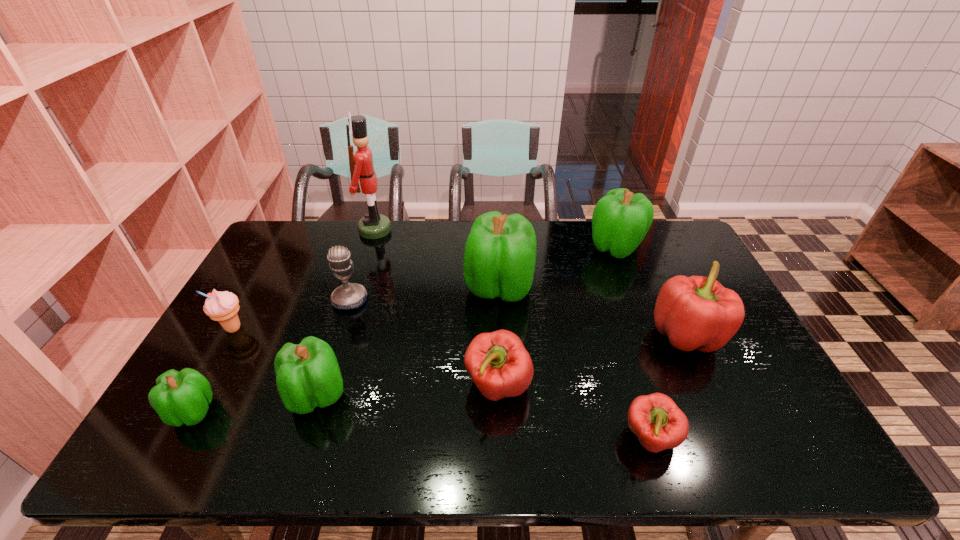
Locate an element on the screen. This screenshot has width=960, height=540. free space that satisfies the following two spatial constraints: 1. on the front-facing side of the microphone; 2. on the left side of the second smallest pink bell pepper is located at coordinates (323, 386).

The width and height of the screenshot is (960, 540). I want to click on vacant area that satisfies the following two spatial constraints: 1. on the front side of the icecream; 2. on the right side of the leftmost pink bell pepper, so click(201, 386).

Find the location of a particular element. free region that satisfies the following two spatial constraints: 1. on the front-facing side of the second biggest pink bell pepper; 2. on the right side of the microphone is located at coordinates (323, 386).

This screenshot has height=540, width=960. What are the coordinates of `free space that satisfies the following two spatial constraints: 1. on the front-facing side of the second pink bell pepper from left to right; 2. on the right side of the microphone` in the screenshot? It's located at (306, 438).